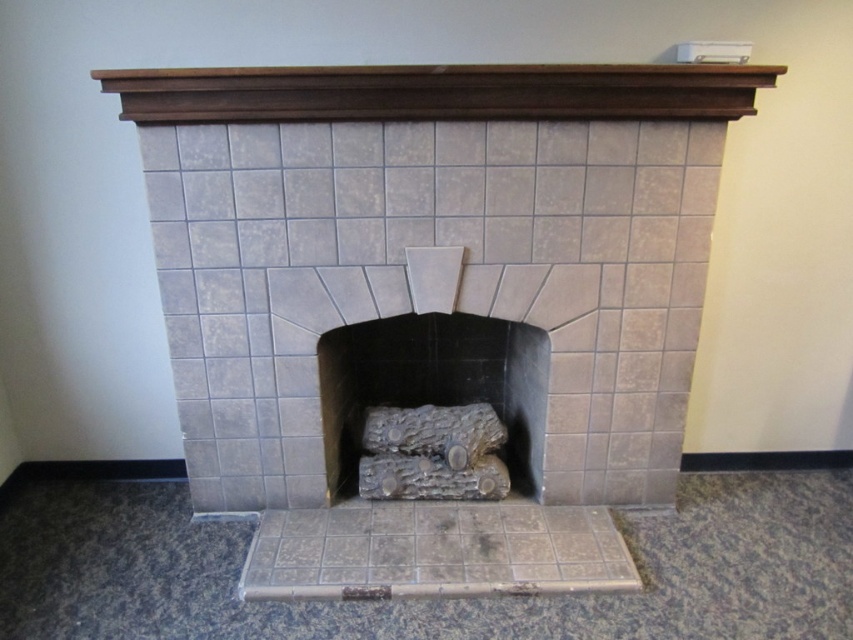
Who is more forward, (675, 284) or (415, 392)?

Point (675, 284) is more forward.

Between point (280, 115) and point (509, 429), which one is positioned behind?

Point (509, 429)

Is point (759, 81) in front of point (396, 404)?

Yes, point (759, 81) is closer to viewer.

Find the location of `gray tile fireplace at center`. gray tile fireplace at center is located at coordinates [x=432, y=296].